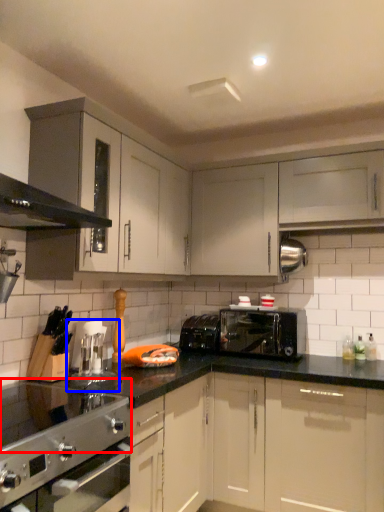
Question: Which point is further to the camera, gas stove (highlighted by a red box) or coffee machine (highlighted by a blue box)?

Choices:
 (A) gas stove
 (B) coffee machine

Answer: (B)